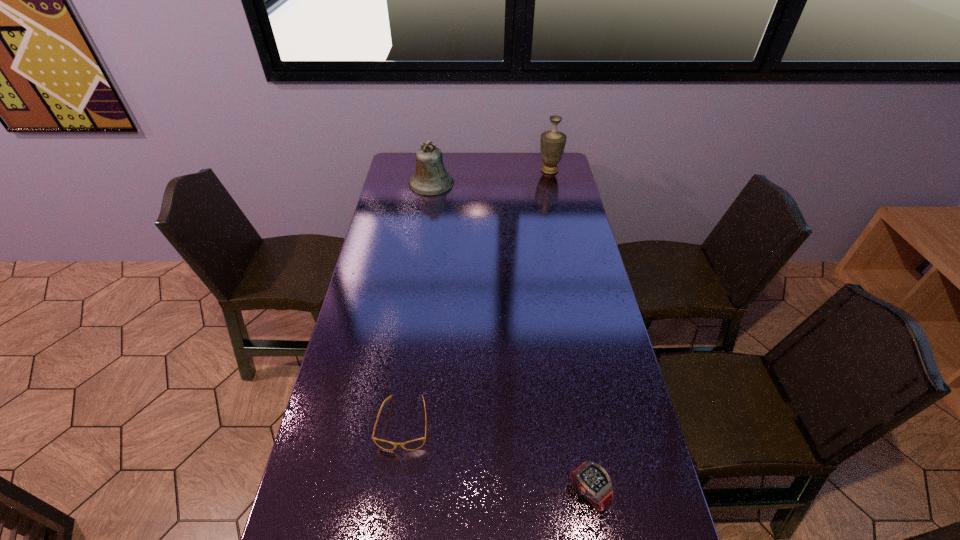
Where is `urn at the far edge`? The height and width of the screenshot is (540, 960). urn at the far edge is located at coordinates coord(552,143).

Find the location of a particular element. bell that is at the far edge is located at coordinates click(x=430, y=178).

Identify the location of bell positioned at the left edge. (430, 178).

Where is `sunglasses present at the left edge`? This screenshot has height=540, width=960. sunglasses present at the left edge is located at coordinates (415, 444).

In order to click on urn that is at the right edge in this screenshot , I will do `click(552, 143)`.

The width and height of the screenshot is (960, 540). I want to click on watch located in the right edge section of the desktop, so (590, 480).

At what (x,y) coordinates should I click in order to perform the action: click on object that is at the far left corner. Please return your answer as a coordinate pair (x, y). The width and height of the screenshot is (960, 540). Looking at the image, I should click on (430, 178).

Identify the location of object situated at the far right corner. The width and height of the screenshot is (960, 540). (552, 143).

You are a GUI agent. You are given a task and a screenshot of the screen. Output one action in this format:
    pyautogui.click(x=<x>, y=<y>)
    Task: Click on the vacant space at the far edge of the desktop
    This screenshot has width=960, height=540.
    Given the screenshot: What is the action you would take?
    pyautogui.click(x=499, y=157)

In the image, there is a desktop. Identify the location of blank space at the left edge. (403, 275).